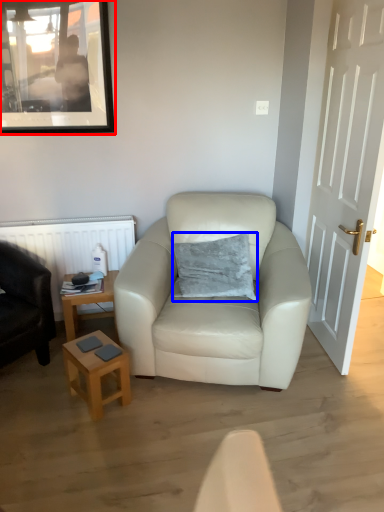
Question: Which object is closer to the camera taking this photo, picture frame (highlighted by a red box) or pillow (highlighted by a blue box)?

Choices:
 (A) picture frame
 (B) pillow

Answer: (B)